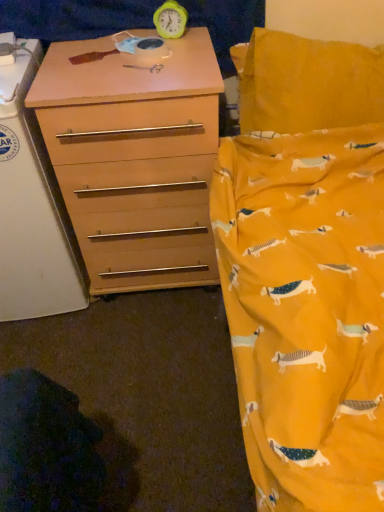
Question: Does matte wood changing table at left have a lesser height compared to matte wood chest of drawers at left?

Choices:
 (A) no
 (B) yes

Answer: (A)

Question: Is matte wood changing table at left to the right of matte wood chest of drawers at left from the viewer's perspective?

Choices:
 (A) no
 (B) yes

Answer: (A)

Question: Is matte wood changing table at left positioned before matte wood chest of drawers at left?

Choices:
 (A) no
 (B) yes

Answer: (B)

Question: Can you see matte wood changing table at left touching matte wood chest of drawers at left?

Choices:
 (A) no
 (B) yes

Answer: (A)

Question: Is the position of matte wood changing table at left more distant than that of matte wood chest of drawers at left?

Choices:
 (A) no
 (B) yes

Answer: (A)

Question: Is matte wood changing table at left in front of or behind green plastic clock at upper center in the image?

Choices:
 (A) behind
 (B) front

Answer: (B)

Question: Which is correct: matte wood changing table at left is inside green plastic clock at upper center, or outside of it?

Choices:
 (A) outside
 (B) inside

Answer: (A)

Question: Is matte wood changing table at left wider or thinner than green plastic clock at upper center?

Choices:
 (A) wide
 (B) thin

Answer: (A)

Question: In the image, is matte wood changing table at left on the left side or the right side of green plastic clock at upper center?

Choices:
 (A) right
 (B) left

Answer: (B)

Question: Considering the relative positions of matte wood chest of drawers at left and matte wood changing table at left in the image provided, is matte wood chest of drawers at left to the left or to the right of matte wood changing table at left?

Choices:
 (A) left
 (B) right

Answer: (B)

Question: In the image, is matte wood chest of drawers at left positioned in front of or behind matte wood changing table at left?

Choices:
 (A) behind
 (B) front

Answer: (A)

Question: From the image's perspective, is matte wood chest of drawers at left positioned above or below matte wood changing table at left?

Choices:
 (A) above
 (B) below

Answer: (A)

Question: Is matte wood chest of drawers at left inside the boundaries of matte wood changing table at left, or outside?

Choices:
 (A) outside
 (B) inside

Answer: (A)

Question: Considering the positions of point (39, 228) and point (119, 229), is point (39, 228) closer or farther from the camera than point (119, 229)?

Choices:
 (A) closer
 (B) farther

Answer: (A)

Question: From the image's perspective, is matte wood changing table at left located above or below matte wood chest of drawers at left?

Choices:
 (A) below
 (B) above

Answer: (A)